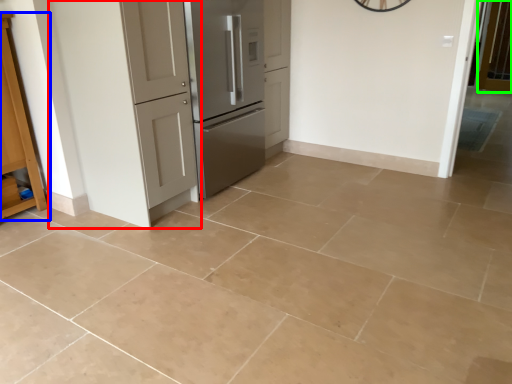
Question: Estimate the real-world distances between objects in this image. Which object is closer to door (highlighted by a red box), cabinetry (highlighted by a blue box) or screen door (highlighted by a green box)?

Choices:
 (A) cabinetry
 (B) screen door

Answer: (A)